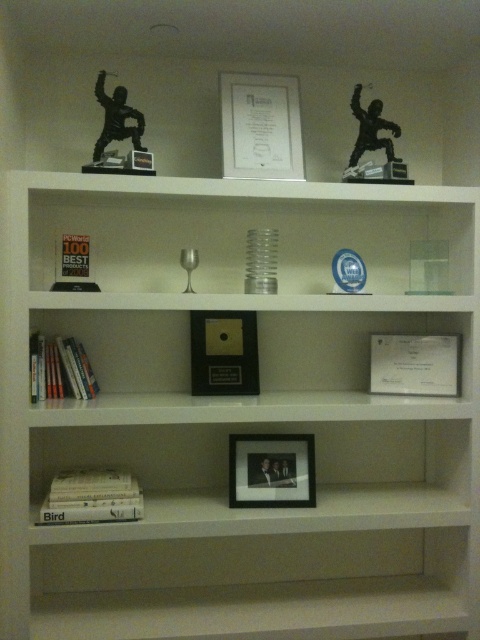
Is point (244, 440) in front of point (211, 360)?

Yes.

Who is lower down, matte black frame at center or metallic gold picture frame at center?

Positioned lower is matte black frame at center.

This screenshot has width=480, height=640. I want to click on matte black frame at center, so click(x=272, y=470).

At what (x,y) coordinates should I click in order to perform the action: click on matte black frame at center. Please return your answer as a coordinate pair (x, y). The height and width of the screenshot is (640, 480). Looking at the image, I should click on (272, 470).

Who is taller, matte black frame at center or hardcover books at lower left?

hardcover books at lower left is taller.

Based on the photo, between matte black frame at center and hardcover books at lower left, which one is positioned lower?

matte black frame at center is lower down.

At what (x,y) coordinates should I click in order to perform the action: click on matte black frame at center. Please return your answer as a coordinate pair (x, y). This screenshot has width=480, height=640. Looking at the image, I should click on (272, 470).

Can you confirm if white glossy bookshelf at upper center is wider than white matte book at lower left?

Yes, white glossy bookshelf at upper center is wider than white matte book at lower left.

In the scene shown: Between white glossy bookshelf at upper center and white matte book at lower left, which one is positioned lower?

white matte book at lower left is below.

Between point (263, 211) and point (98, 502), which one is positioned in front?

Point (98, 502) is in front.

Find the location of `white glossy bookshelf at upper center`. white glossy bookshelf at upper center is located at coordinates [239, 413].